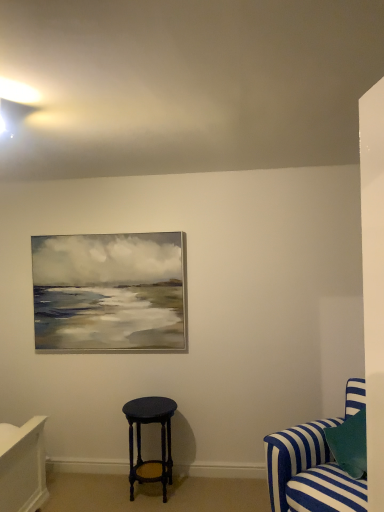
The image size is (384, 512). Describe the element at coordinates (140, 440) in the screenshot. I see `matte dark blue stool at center` at that location.

Where is `matte dark blue stool at center`? The width and height of the screenshot is (384, 512). matte dark blue stool at center is located at coordinates (140, 440).

In order to face matte dark blue stool at center, should I rotate leftwards or rightwards?

Rotate left and turn 5.423 degrees.

Measure the distance between point [155,471] and camera.

Point [155,471] and camera are 3.24 meters apart from each other.

Where is `blue striped fabric couch at lower right`? The width and height of the screenshot is (384, 512). blue striped fabric couch at lower right is located at coordinates (314, 465).

The image size is (384, 512). Describe the element at coordinates (314, 465) in the screenshot. I see `blue striped fabric couch at lower right` at that location.

Where is `matte dark blue stool at center`? The height and width of the screenshot is (512, 384). matte dark blue stool at center is located at coordinates (140, 440).

Which object is positioned more to the left, blue striped fabric couch at lower right or matte dark blue stool at center?

Positioned to the left is matte dark blue stool at center.

In the scene shown: Which object is closer to the camera, blue striped fabric couch at lower right or matte dark blue stool at center?

Positioned in front is blue striped fabric couch at lower right.

Is point (361, 488) closer or farther from the camera than point (162, 425)?

Point (361, 488) is positioned closer to the camera compared to point (162, 425).

From the image's perspective, which object appears higher, blue striped fabric couch at lower right or matte dark blue stool at center?

blue striped fabric couch at lower right appears higher in the image.

From a real-world perspective, is blue striped fabric couch at lower right above or below matte dark blue stool at center?

From a real-world perspective, blue striped fabric couch at lower right is physically above matte dark blue stool at center.

In terms of width, does blue striped fabric couch at lower right look wider or thinner when compared to matte dark blue stool at center?

In the image, blue striped fabric couch at lower right appears to be wider than matte dark blue stool at center.

Is blue striped fabric couch at lower right taller or shorter than matte dark blue stool at center?

Considering their sizes, blue striped fabric couch at lower right has more height than matte dark blue stool at center.

Considering the sizes of objects blue striped fabric couch at lower right and matte dark blue stool at center in the image provided, who is bigger, blue striped fabric couch at lower right or matte dark blue stool at center?

blue striped fabric couch at lower right is bigger.

Which is correct: blue striped fabric couch at lower right is inside matte dark blue stool at center, or outside of it?

Result: blue striped fabric couch at lower right exists outside the volume of matte dark blue stool at center.

Is blue striped fabric couch at lower right with matte dark blue stool at center?

No, blue striped fabric couch at lower right is not beside matte dark blue stool at center.

Is blue striped fabric couch at lower right facing towards matte dark blue stool at center?

No.

How different are the orientations of blue striped fabric couch at lower right and matte dark blue stool at center in degrees?

The facing directions of blue striped fabric couch at lower right and matte dark blue stool at center are 47.5 degrees apart.

You are a GUI agent. You are given a task and a screenshot of the screen. Output one action in this format:
    pyautogui.click(x=<x>, y=<y>)
    Task: Click on the studio couch that is in front of the matte dark blue stool at center
    The width and height of the screenshot is (384, 512).
    Given the screenshot: What is the action you would take?
    pyautogui.click(x=314, y=465)

Between matte dark blue stool at center and blue striped fabric couch at lower right, which one appears on the left side from the viewer's perspective?

Positioned to the left is matte dark blue stool at center.

From the picture: Which object is closer to the camera, matte dark blue stool at center or blue striped fabric couch at lower right?

blue striped fabric couch at lower right.

Which point is more forward, (163,397) or (268,462)?

The point (268,462) is more forward.

From the image's perspective, which is below, matte dark blue stool at center or blue striped fabric couch at lower right?

From the image's view, matte dark blue stool at center is below.

From a real-world perspective, is matte dark blue stool at center located higher than blue striped fabric couch at lower right?

Incorrect, from a real-world perspective, matte dark blue stool at center is lower than blue striped fabric couch at lower right.

Is matte dark blue stool at center wider than blue striped fabric couch at lower right?

No, matte dark blue stool at center is not wider than blue striped fabric couch at lower right.

Which of these two, matte dark blue stool at center or blue striped fabric couch at lower right, stands taller?

Standing taller between the two is blue striped fabric couch at lower right.

Considering the sizes of objects matte dark blue stool at center and blue striped fabric couch at lower right in the image provided, who is smaller, matte dark blue stool at center or blue striped fabric couch at lower right?

matte dark blue stool at center is smaller.

Is matte dark blue stool at center positioned beyond the bounds of blue striped fabric couch at lower right?

Absolutely, matte dark blue stool at center is external to blue striped fabric couch at lower right.

Is matte dark blue stool at center far away from blue striped fabric couch at lower right?

Yes, matte dark blue stool at center is far from blue striped fabric couch at lower right.

Could you tell me if matte dark blue stool at center is turned towards blue striped fabric couch at lower right?

No.

Can you tell me how much matte dark blue stool at center and blue striped fabric couch at lower right differ in facing direction?

47.5 degrees separate the facing orientations of matte dark blue stool at center and blue striped fabric couch at lower right.

Find the location of a particular element. stool that is behind the blue striped fabric couch at lower right is located at coordinates (140, 440).

Identify the location of stool below the blue striped fabric couch at lower right (from the image's perspective). Image resolution: width=384 pixels, height=512 pixels. (140, 440).

This screenshot has width=384, height=512. Find the location of `studio couch on the right side of matte dark blue stool at center`. studio couch on the right side of matte dark blue stool at center is located at coordinates (314, 465).